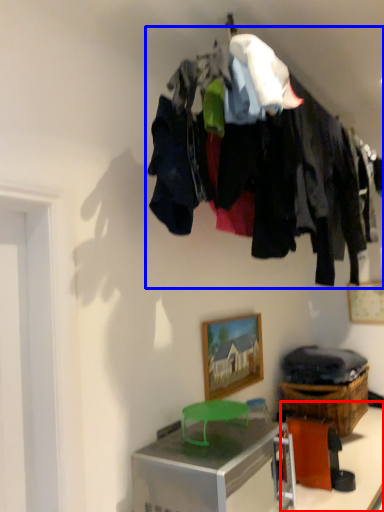
Question: Which object is further to the camera taking this photo, table (highlighted by a red box) or closet (highlighted by a blue box)?

Choices:
 (A) table
 (B) closet

Answer: (A)